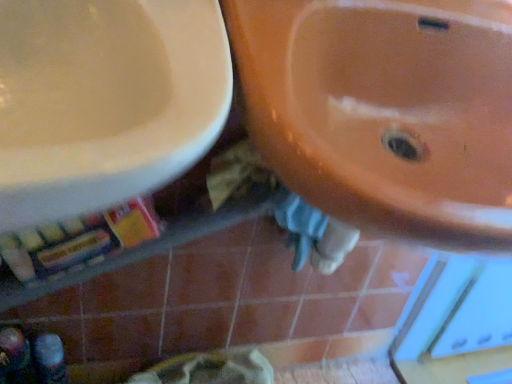
This screenshot has width=512, height=384. Describe the element at coordinates (385, 111) in the screenshot. I see `matte orange sink at center` at that location.

I want to click on matte orange sink at center, so click(x=385, y=111).

What are the coordinates of `matte orange sink at center` in the screenshot? It's located at (385, 111).